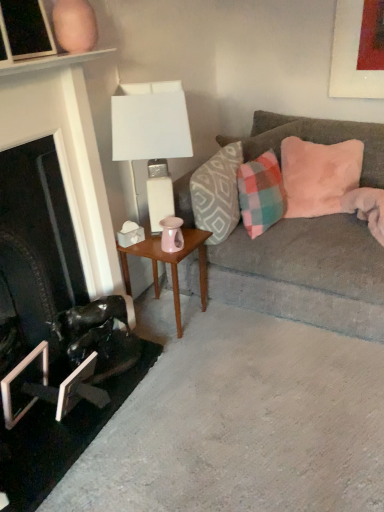
I want to click on free location in front of metallic silver picture frame at lower left, which appears as the first picture frame when ordered from the bottom, so click(59, 446).